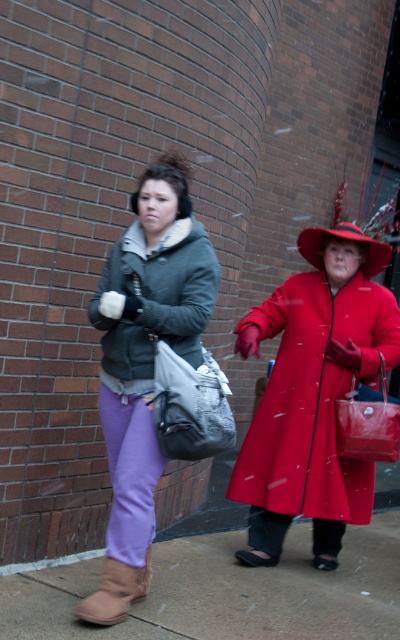
Which is more to the right, shiny red leather handbag at center or brown suede boot at lower left?

From the viewer's perspective, shiny red leather handbag at center appears more on the right side.

Which is behind, point (352, 381) or point (118, 605)?

The point (352, 381) is more distant.

I want to click on shiny red leather handbag at center, so click(368, 422).

Which is behind, point (290, 600) or point (384, 408)?

Positioned behind is point (384, 408).

Is brown concrete sidewalk at lower center thinner than shiny red leather handbag at center?

In fact, brown concrete sidewalk at lower center might be wider than shiny red leather handbag at center.

Where is `brown concrete sidewalk at lower center`? The height and width of the screenshot is (640, 400). brown concrete sidewalk at lower center is located at coordinates (227, 593).

Is matte gray coat at center further to camera compared to red felt hat at center?

No, it is not.

Does matte gray coat at center appear on the right side of red felt hat at center?

In fact, matte gray coat at center is to the left of red felt hat at center.

Is point (192, 248) less distant than point (314, 237)?

Yes, point (192, 248) is in front of point (314, 237).

I want to click on matte gray coat at center, so click(159, 300).